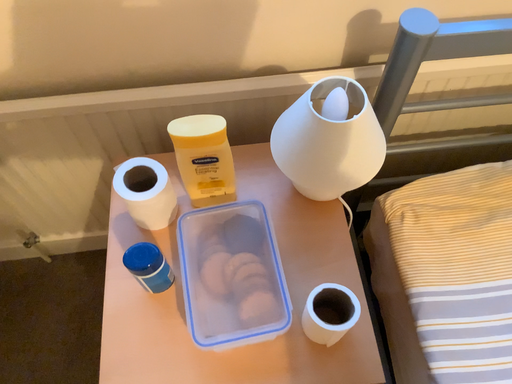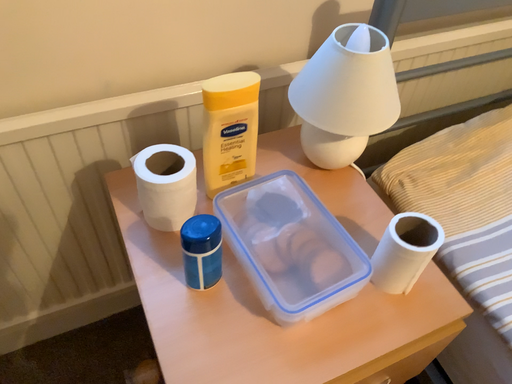
Question: Which way did the camera rotate in the video?

Choices:
 (A) rotated left
 (B) rotated right

Answer: (B)